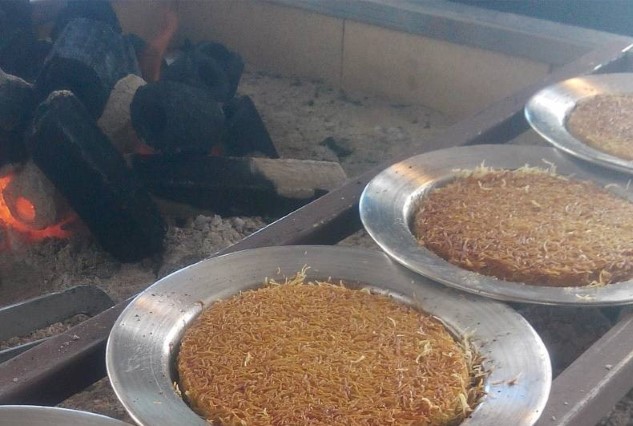
The image size is (633, 426). In order to click on plate 3 in this screenshot , I will do 556,133.